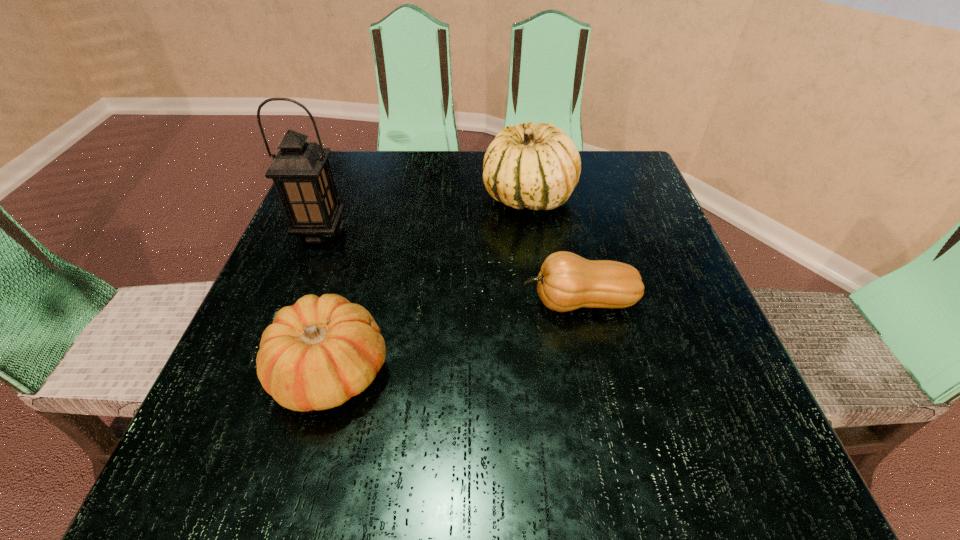
You are a GUI agent. You are given a task and a screenshot of the screen. Output one action in this format:
    pyautogui.click(x=<x>, y=<y>)
    Task: Click on the lantern
    
    Given the screenshot: What is the action you would take?
    pyautogui.click(x=301, y=172)

Identify the location of the third shortest object. This screenshot has height=540, width=960. (537, 167).

Locate an element on the screen. the farthest gourd is located at coordinates (537, 167).

Identify the location of the nearest gourd. (318, 353).

The image size is (960, 540). Identify the location of the leftmost gourd. (318, 353).

Identify the location of the second nearest gourd. (567, 281).

Where is `vacant space located 0.100m on the front of the lantern`? The height and width of the screenshot is (540, 960). vacant space located 0.100m on the front of the lantern is located at coordinates (300, 285).

Identify the location of free space located on the left of the tallest gourd. The image size is (960, 540). pos(460,197).

Where is `vacant region located 0.160m on the back of the nearest object`? Image resolution: width=960 pixels, height=540 pixels. vacant region located 0.160m on the back of the nearest object is located at coordinates (363, 260).

Find the location of `free space located on the stem side of the second farthest gourd`. free space located on the stem side of the second farthest gourd is located at coordinates (296, 302).